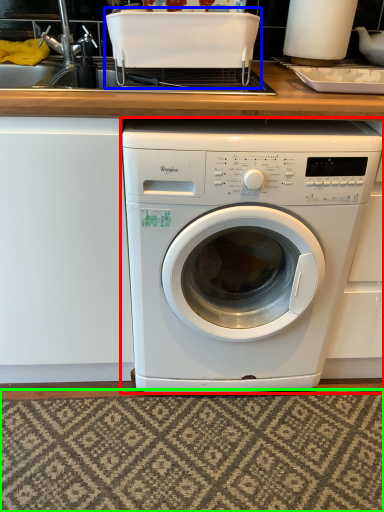
Question: Which object is positioned farthest from washing machine (highlighted by a red box)? Select from appliance (highlighted by a blue box) and mat (highlighted by a green box).

Choices:
 (A) appliance
 (B) mat

Answer: (A)